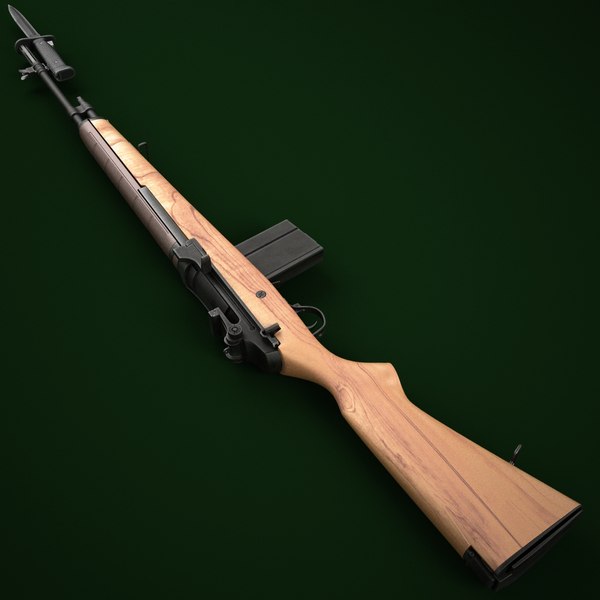
At what (x,y) coordinates should I click in order to perform the action: click on handle. Please return your answer as a coordinate pair (x, y). This screenshot has width=600, height=600. Looking at the image, I should click on (385, 367).